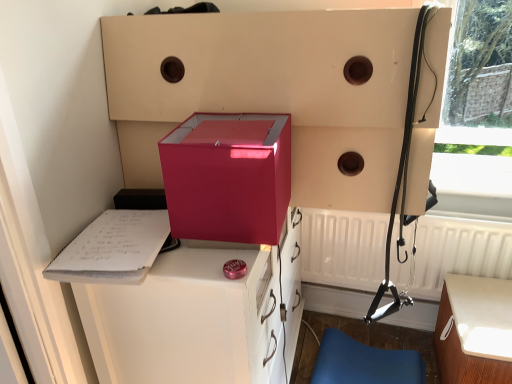
Question: From the image's perspective, is blue leather chair at lower right located above or below matte pink box at center?

Choices:
 (A) below
 (B) above

Answer: (A)

Question: Considering the relative positions of blue leather chair at lower right and matte pink box at center in the image provided, is blue leather chair at lower right to the left or to the right of matte pink box at center?

Choices:
 (A) left
 (B) right

Answer: (B)

Question: Which object is the closest to the matte black harness at right?

Choices:
 (A) white matte radiator at lower right
 (B) blue leather chair at lower right
 (C) glossy plastic vanity at center
 (D) white wood table at lower right
 (E) matte pink box at center

Answer: (A)

Question: Based on their relative distances, which object is nearer to the matte black harness at right?

Choices:
 (A) glossy plastic vanity at center
 (B) white paper clipboard at left
 (C) blue leather chair at lower right
 (D) white matte radiator at lower right
 (E) matte pink box at center

Answer: (D)